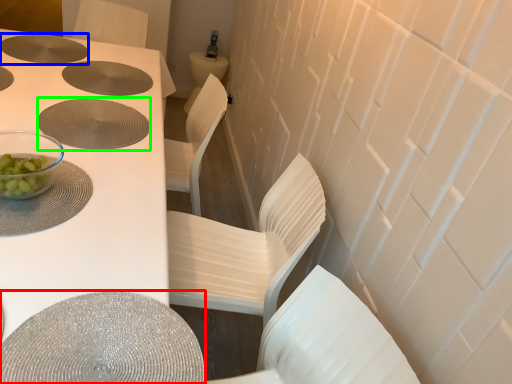
Question: Which is farther away from round table (highlighted by a red box)? hole (highlighted by a blue box) or hole (highlighted by a green box)?

Choices:
 (A) hole
 (B) hole

Answer: (A)